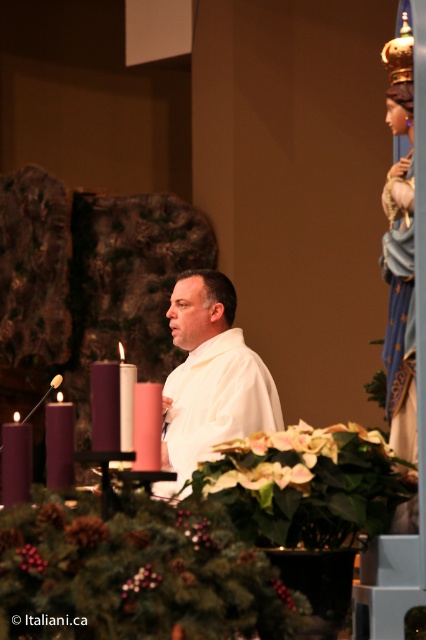
You are an interior designer planning to add a new decoration to the church scene. The purple matte candle at center is currently located at point (104, 404). Where should you place the new decoration so it doesn not block the candle?

The purple matte candle at center is located at point (104, 404). To avoid blocking it, place the new decoration away from that coordinate.

You are standing in the church and see the point marked at coordinates [210,378]. What object is located at that point?

The point at coordinates [210,378] marks the white matte or soft fabric at center.